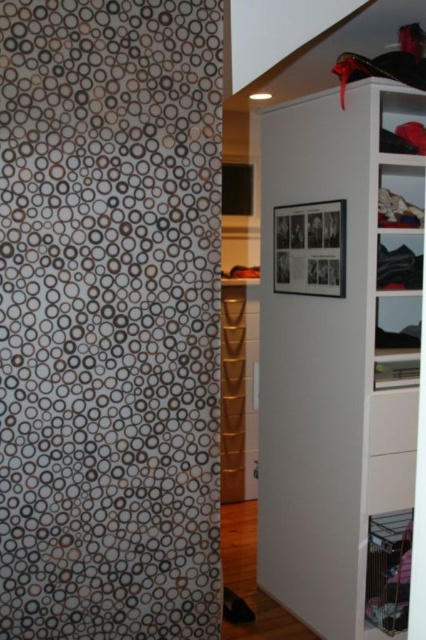
Question: In this image, where is white matte shower curtain at left located relative to white matte cabinet at upper right?

Choices:
 (A) left
 (B) right

Answer: (A)

Question: Is white matte shower curtain at left wider than white matte cabinet at upper right?

Choices:
 (A) yes
 (B) no

Answer: (B)

Question: Is white matte shower curtain at left bigger than white matte cabinet at upper right?

Choices:
 (A) yes
 (B) no

Answer: (B)